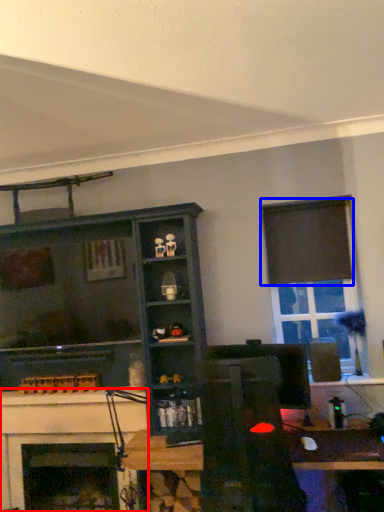
Question: Which object appears farthest to the camera in this image, fireplace (highlighted by a red box) or curtain (highlighted by a blue box)?

Choices:
 (A) fireplace
 (B) curtain

Answer: (B)